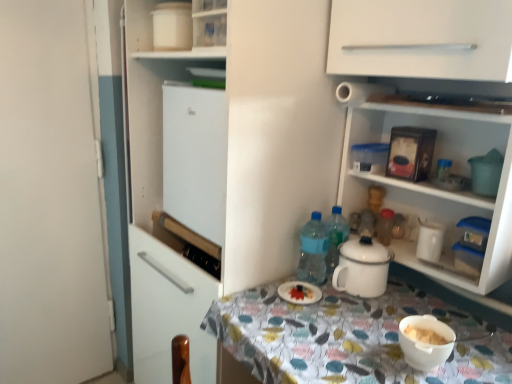
Question: From a real-world perspective, does white matte door at left sit lower than white glossy plate at center?

Choices:
 (A) yes
 (B) no

Answer: (B)

Question: Is white matte door at left thinner than white glossy plate at center?

Choices:
 (A) yes
 (B) no

Answer: (A)

Question: Considering the relative positions of white matte door at left and white glossy plate at center in the image provided, is white matte door at left to the right of white glossy plate at center from the viewer's perspective?

Choices:
 (A) yes
 (B) no

Answer: (B)

Question: Is white matte door at left aimed at white glossy plate at center?

Choices:
 (A) yes
 (B) no

Answer: (B)

Question: Is white matte door at left far away from white glossy plate at center?

Choices:
 (A) yes
 (B) no

Answer: (A)

Question: From their relative heights in the image, would you say white glossy plate at center is taller or shorter than translucent plastic bottle at upper right, marked as the first bottle in a right-to-left arrangement?

Choices:
 (A) tall
 (B) short

Answer: (B)

Question: Which is correct: white glossy plate at center is inside translucent plastic bottle at upper right, marked as the first bottle in a right-to-left arrangement, or outside of it?

Choices:
 (A) outside
 (B) inside

Answer: (A)

Question: Based on their sizes in the image, would you say white glossy plate at center is bigger or smaller than translucent plastic bottle at upper right, marked as the first bottle in a right-to-left arrangement?

Choices:
 (A) small
 (B) big

Answer: (B)

Question: Relative to translucent plastic bottle at upper right, which is the second bottle from left to right, is white glossy plate at center in front or behind?

Choices:
 (A) front
 (B) behind

Answer: (A)

Question: Is translucent plastic bottle at upper right, marked as the first bottle in a right-to-left arrangement, situated inside white glossy plate at center or outside?

Choices:
 (A) outside
 (B) inside

Answer: (A)

Question: Is translucent plastic bottle at upper right, which is the second bottle from left to right, taller or shorter than white glossy plate at center?

Choices:
 (A) tall
 (B) short

Answer: (A)

Question: From a real-world perspective, is translucent plastic bottle at upper right, marked as the first bottle in a right-to-left arrangement, physically located above or below white glossy plate at center?

Choices:
 (A) above
 (B) below

Answer: (A)

Question: Looking at their shapes, would you say translucent plastic bottle at upper right, which is the second bottle from left to right, is wider or thinner than white glossy plate at center?

Choices:
 (A) wide
 (B) thin

Answer: (B)

Question: Considering the positions of white glossy plate at center and white matte cabinet at upper center in the image, is white glossy plate at center wider or thinner than white matte cabinet at upper center?

Choices:
 (A) wide
 (B) thin

Answer: (B)

Question: In terms of size, does white glossy plate at center appear bigger or smaller than white matte cabinet at upper center?

Choices:
 (A) big
 (B) small

Answer: (B)